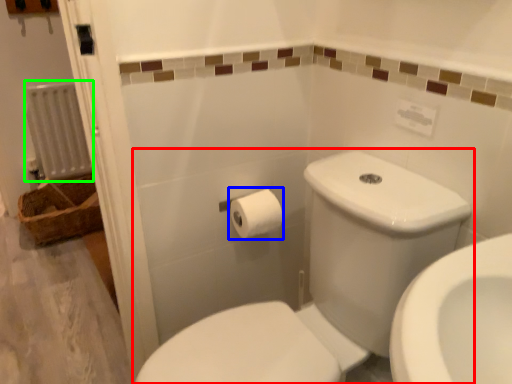
Question: Which object is the closest to the toilet (highlighted by a red box)? Choose among these: toilet paper (highlighted by a blue box) or radiator (highlighted by a green box).

Choices:
 (A) toilet paper
 (B) radiator

Answer: (A)